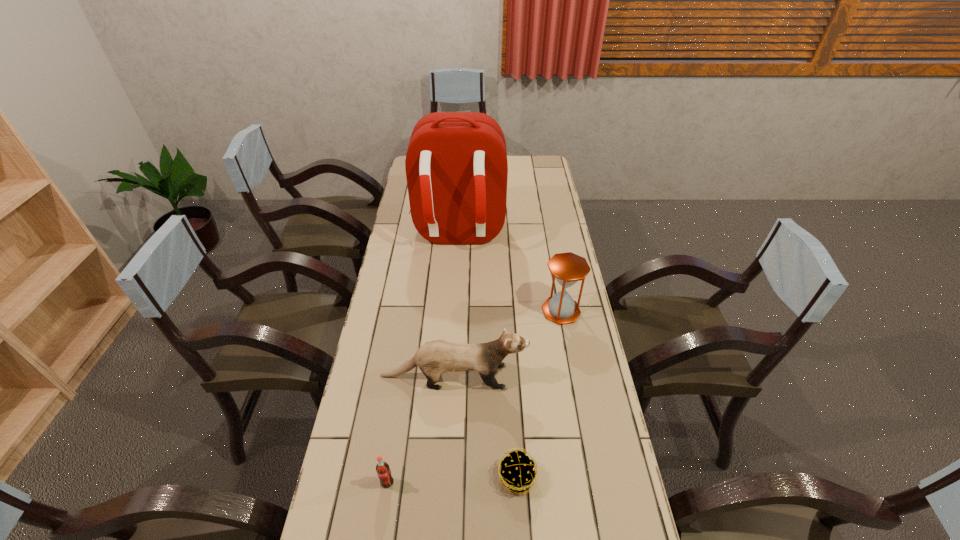
Locate an element on the screen. The width and height of the screenshot is (960, 540). vacant space located on the label of the soda bottle is located at coordinates (382, 514).

Identify the location of vacant space located on the left of the patty. (381, 477).

Identify the location of backpack that is at the left edge. This screenshot has height=540, width=960. (456, 165).

Identify the location of ferret present at the left edge. (434, 358).

Where is `soda bottle located at the left edge`? soda bottle located at the left edge is located at coordinates (383, 470).

Find the location of a particular element. object that is positioned at the right edge is located at coordinates (568, 268).

The width and height of the screenshot is (960, 540). In the image, there is a desktop. In order to click on free space at the left edge in this screenshot , I will do `click(386, 277)`.

Image resolution: width=960 pixels, height=540 pixels. I want to click on free space at the right edge of the desktop, so click(x=619, y=474).

At what (x,y) coordinates should I click in order to perform the action: click on vacant space that's between the fourth tallest object and the hourglass. Please return your answer as a coordinate pair (x, y). The width and height of the screenshot is (960, 540). Looking at the image, I should click on (x=474, y=397).

Locate an element on the screen. unoccupied area between the ferret and the backpack is located at coordinates (455, 306).